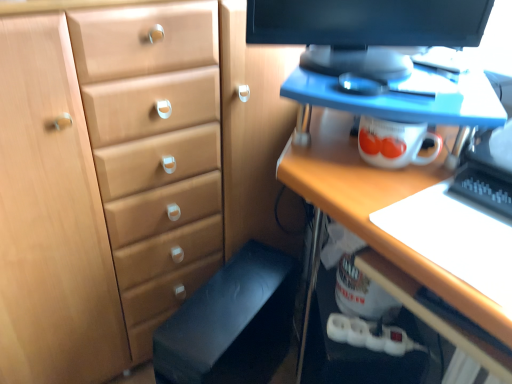
Question: Considering the positions of light brown wood chest of drawers at center and black fabric computer chair at lower center in the image, is light brown wood chest of drawers at center taller or shorter than black fabric computer chair at lower center?

Choices:
 (A) tall
 (B) short

Answer: (A)

Question: Relative to black fabric computer chair at lower center, is light brown wood chest of drawers at center in front or behind?

Choices:
 (A) front
 (B) behind

Answer: (A)

Question: Which is farther from the black glossy monitor at upper center?

Choices:
 (A) matte wood desk at upper right
 (B) black fabric computer chair at lower center
 (C) light brown wood chest of drawers at center

Answer: (B)

Question: Based on their relative distances, which object is farther from the black fabric computer chair at lower center?

Choices:
 (A) matte wood desk at upper right
 (B) black glossy monitor at upper center
 (C) light brown wood chest of drawers at center

Answer: (B)